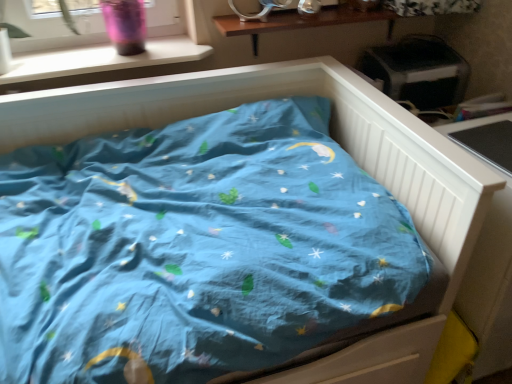
Question: Based on their sizes in the image, would you say white plastic window sill at upper left is bigger or smaller than white wooden table at right?

Choices:
 (A) big
 (B) small

Answer: (B)

Question: Is white plastic window sill at upper left inside or outside of white wooden table at right?

Choices:
 (A) inside
 (B) outside

Answer: (B)

Question: Is point (86, 61) positioned closer to the camera than point (489, 274)?

Choices:
 (A) closer
 (B) farther

Answer: (B)

Question: From the image's perspective, relative to white plastic window sill at upper left, is white wooden table at right above or below?

Choices:
 (A) above
 (B) below

Answer: (B)

Question: In the image, is white wooden table at right on the left side or the right side of white plastic window sill at upper left?

Choices:
 (A) left
 (B) right

Answer: (B)

Question: Is white wooden table at right taller or shorter than white plastic window sill at upper left?

Choices:
 (A) short
 (B) tall

Answer: (B)

Question: Is white wooden table at right wider or thinner than white plastic window sill at upper left?

Choices:
 (A) thin
 (B) wide

Answer: (B)